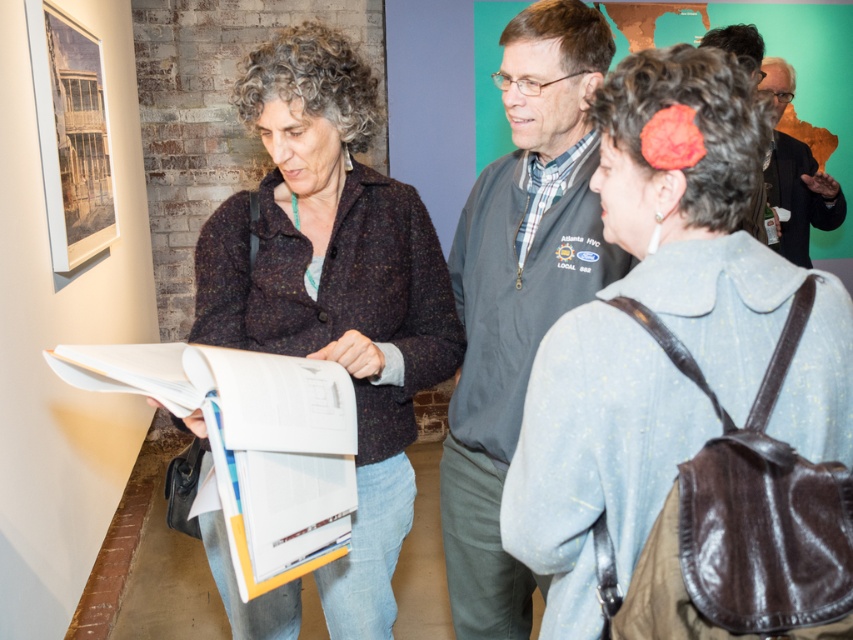
You are a visitor in the art gallery and want to approach the person wearing the gray fleece vest at center to ask a question. Can you easily reach them without moving around the person in the matte gray jacket at upper right?

The gray fleece vest at center is in front of the matte gray jacket at upper right, so you can approach the person in the gray fleece vest at center directly without needing to move around the person in the matte gray jacket at upper right.

You are a tour guide standing at the entrance of the art gallery. You want to hand out a brochure to the person wearing the speckled wool sweater at center. Can you reach them without moving from your current position if your arm can extend 0.8 meters?

The speckled wool sweater at center is 1.28 meters away from the viewer. Since your arm can only extend 0.8 meters, you cannot reach them without moving closer.